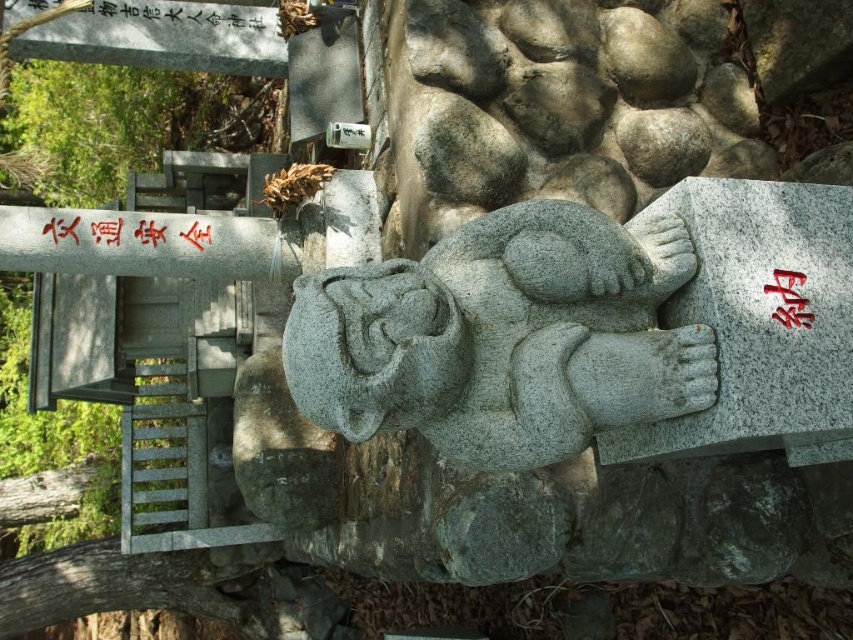
Can you confirm if red paper sign at center is bigger than black stone writing at upper center?

Correct, red paper sign at center is larger in size than black stone writing at upper center.

Does point (62, 216) lie behind point (184, 0)?

No, (62, 216) is in front of (184, 0).

Identify the location of red paper sign at center. (126, 228).

Which is in front, point (386, 308) or point (137, 248)?

Point (386, 308) is more forward.

Is gray stone statue at center bigger than red paper sign at center?

Yes.

Is point (631, 316) positioned before point (82, 220)?

Yes.

You are a GUI agent. You are given a task and a screenshot of the screen. Output one action in this format:
    pyautogui.click(x=<x>, y=<y>)
    Task: Click on the gray stone statue at center
    This screenshot has height=640, width=853.
    Given the screenshot: What is the action you would take?
    pyautogui.click(x=503, y=337)

Consider the image. Can you confirm if gray stone statue at center is positioned below black stone writing at upper center?

Yes.

Who is more forward, (547, 205) or (247, 1)?

Point (547, 205)

Is point (300, 356) closer to camera compared to point (38, 0)?

Yes, point (300, 356) is in front of point (38, 0).

At what (x,y) coordinates should I click in order to perform the action: click on gray stone statue at center. Please return your answer as a coordinate pair (x, y). Looking at the image, I should click on (503, 337).